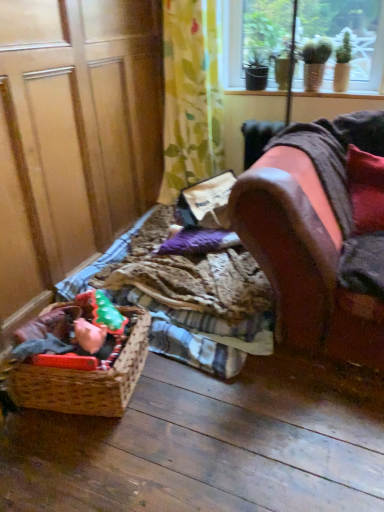
Identify the location of vacant point above woven brown basket at lower left (from a real-world perspective). Image resolution: width=384 pixels, height=512 pixels. (81, 331).